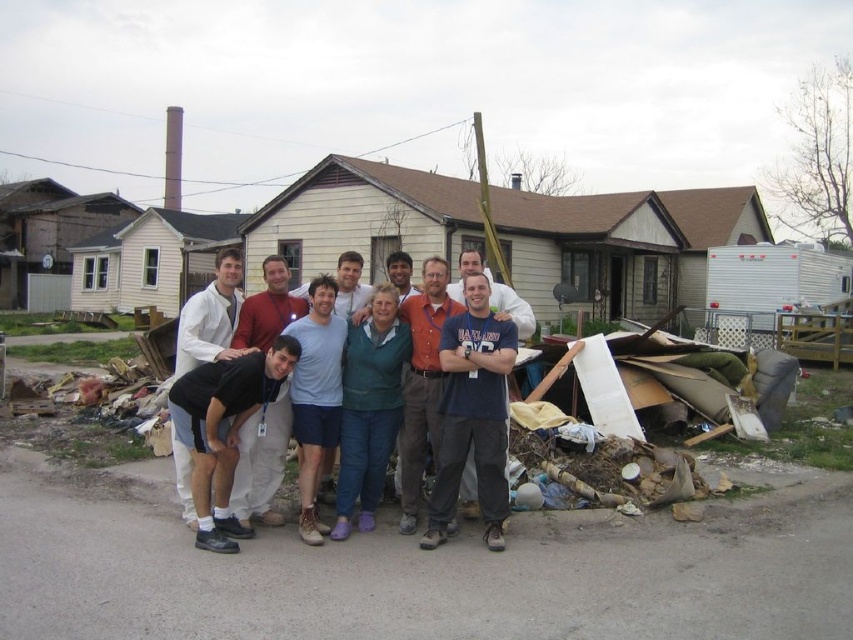
Can you confirm if matte white shirt at center is smaller than black fabric at center?

Actually, matte white shirt at center might be larger than black fabric at center.

Image resolution: width=853 pixels, height=640 pixels. Find the location of `matte white shirt at center`. matte white shirt at center is located at coordinates (247, 413).